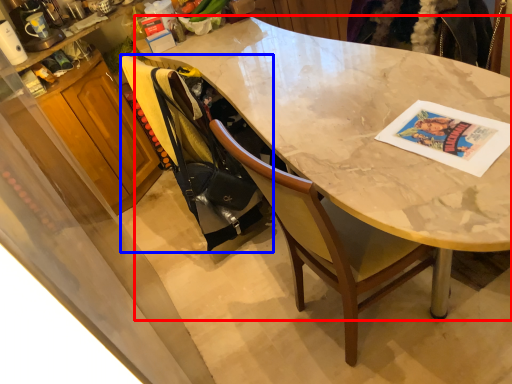
Question: Which of the following is the closest to the observer, desk (highlighted by a red box) or handbag (highlighted by a blue box)?

Choices:
 (A) desk
 (B) handbag

Answer: (A)